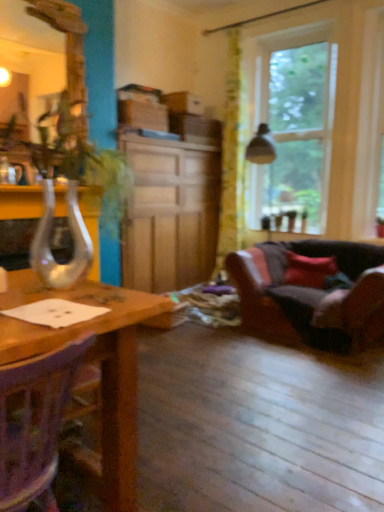
Question: Considering the relative sizes of wooden cabinet at center and leather couch at lower right in the image provided, is wooden cabinet at center bigger than leather couch at lower right?

Choices:
 (A) no
 (B) yes

Answer: (B)

Question: Considering the relative positions of wooden cabinet at center and leather couch at lower right in the image provided, is wooden cabinet at center to the right of leather couch at lower right from the viewer's perspective?

Choices:
 (A) yes
 (B) no

Answer: (B)

Question: Is wooden cabinet at center placed right next to leather couch at lower right?

Choices:
 (A) no
 (B) yes

Answer: (A)

Question: From a real-world perspective, is wooden cabinet at center beneath leather couch at lower right?

Choices:
 (A) yes
 (B) no

Answer: (B)

Question: Is wooden cabinet at center smaller than leather couch at lower right?

Choices:
 (A) no
 (B) yes

Answer: (A)

Question: Does point [x=21, y=498] appear closer or farther from the camera than point [x=226, y=72]?

Choices:
 (A) closer
 (B) farther

Answer: (A)

Question: In the image, is wooden chair at lower left on the left side or the right side of green floral fabric curtain at upper center?

Choices:
 (A) left
 (B) right

Answer: (A)

Question: From their relative heights in the image, would you say wooden chair at lower left is taller or shorter than green floral fabric curtain at upper center?

Choices:
 (A) tall
 (B) short

Answer: (B)

Question: From the image's perspective, is wooden chair at lower left positioned above or below green floral fabric curtain at upper center?

Choices:
 (A) below
 (B) above

Answer: (A)

Question: Does point (137, 147) appear closer or farther from the camera than point (105, 153)?

Choices:
 (A) farther
 (B) closer

Answer: (A)

Question: Is wooden cabinet at center wider or thinner than clear glass vase at left?

Choices:
 (A) wide
 (B) thin

Answer: (A)

Question: From the image's perspective, is wooden cabinet at center positioned above or below clear glass vase at left?

Choices:
 (A) below
 (B) above

Answer: (B)

Question: From their relative heights in the image, would you say wooden cabinet at center is taller or shorter than clear glass vase at left?

Choices:
 (A) short
 (B) tall

Answer: (B)

Question: Considering the positions of red velvet cushion at right and clear glass vase at left in the image, is red velvet cushion at right bigger or smaller than clear glass vase at left?

Choices:
 (A) small
 (B) big

Answer: (A)

Question: Is point (316, 262) closer or farther from the camera than point (49, 204)?

Choices:
 (A) closer
 (B) farther

Answer: (B)